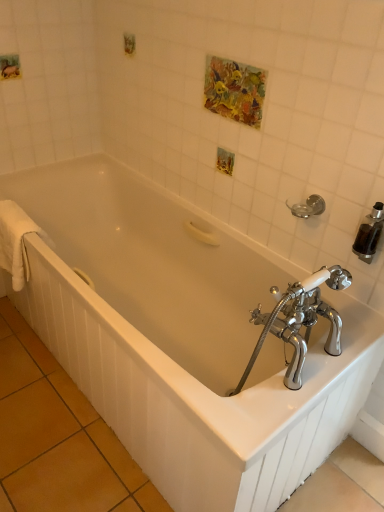
Question: Does white soft towel at left have a greater width compared to white glossy bathtub at center?

Choices:
 (A) yes
 (B) no

Answer: (B)

Question: Is white soft towel at left at the right side of white glossy bathtub at center?

Choices:
 (A) yes
 (B) no

Answer: (B)

Question: From a real-world perspective, is white soft towel at left positioned over white glossy bathtub at center based on gravity?

Choices:
 (A) no
 (B) yes

Answer: (B)

Question: Is white soft towel at left outside white glossy bathtub at center?

Choices:
 (A) no
 (B) yes

Answer: (A)

Question: Is white soft towel at left behind white glossy bathtub at center?

Choices:
 (A) no
 (B) yes

Answer: (B)

Question: Is white glossy bathtub at center inside white soft towel at left?

Choices:
 (A) yes
 (B) no

Answer: (B)

Question: From the image's perspective, is white glossy bathtub at center under silver metallic towel bar at upper right?

Choices:
 (A) yes
 (B) no

Answer: (A)

Question: Considering the relative sizes of white glossy bathtub at center and silver metallic towel bar at upper right in the image provided, is white glossy bathtub at center taller than silver metallic towel bar at upper right?

Choices:
 (A) yes
 (B) no

Answer: (A)

Question: From the image's perspective, is white glossy bathtub at center above silver metallic towel bar at upper right?

Choices:
 (A) yes
 (B) no

Answer: (B)

Question: Is white glossy bathtub at center closer to camera compared to silver metallic towel bar at upper right?

Choices:
 (A) no
 (B) yes

Answer: (B)

Question: From a real-world perspective, is white glossy bathtub at center physically above silver metallic towel bar at upper right?

Choices:
 (A) no
 (B) yes

Answer: (A)

Question: Is white glossy bathtub at center at the left side of silver metallic towel bar at upper right?

Choices:
 (A) no
 (B) yes

Answer: (B)

Question: From the image's perspective, is white soft towel at left over silver metallic towel bar at upper right?

Choices:
 (A) no
 (B) yes

Answer: (A)